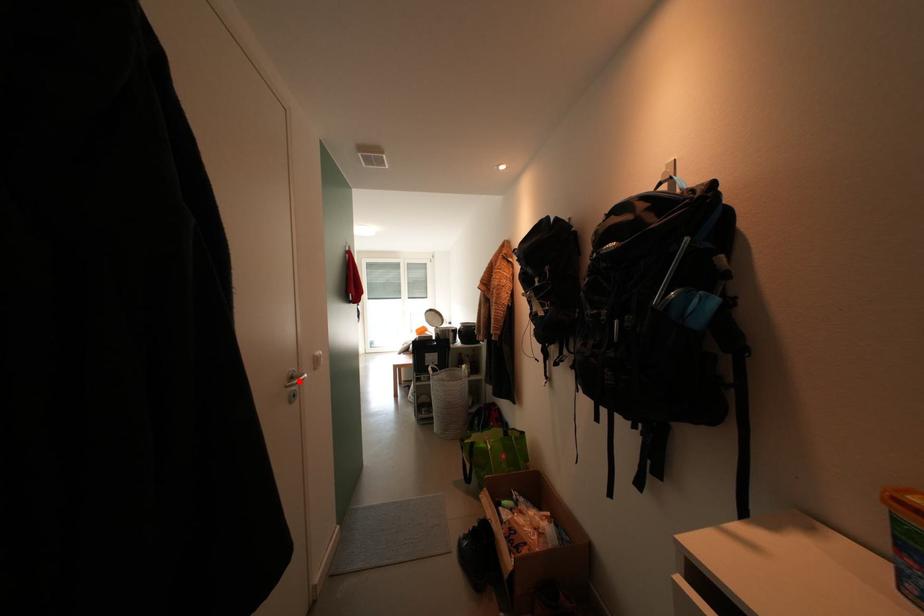
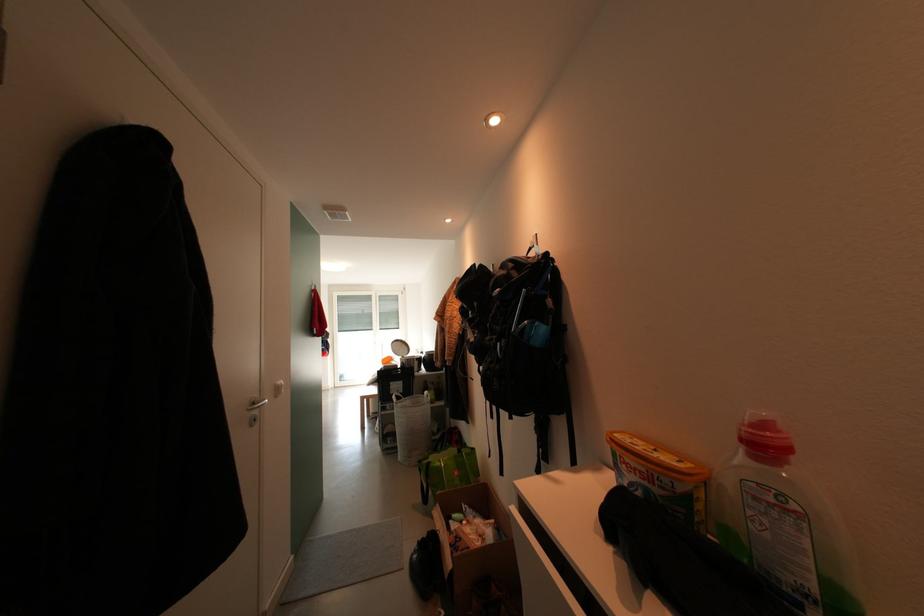
Locate, in the second image, the point that corresponds to the highlighted location in the first image.

(261, 407)